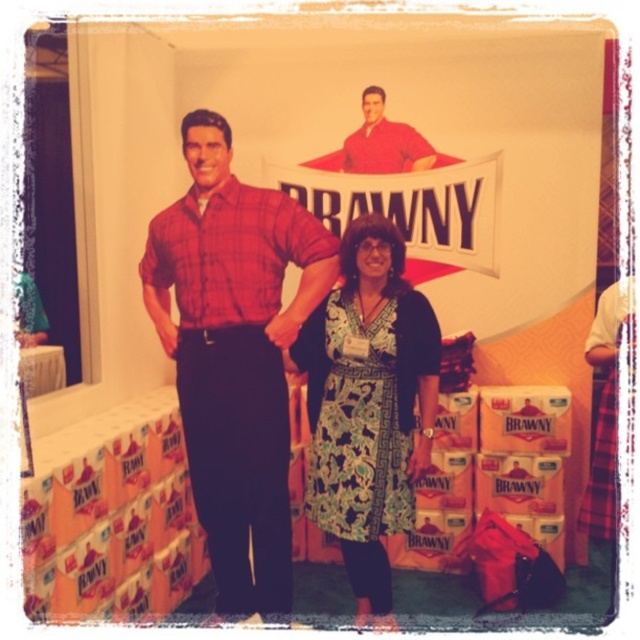
Question: Can you confirm if printed fabric dress at center is smaller than matte red shirt at center?

Choices:
 (A) yes
 (B) no

Answer: (B)

Question: Which object is farther from the camera taking this photo?

Choices:
 (A) printed fabric dress at center
 (B) matte red shirt at center

Answer: (B)

Question: Can you confirm if printed fabric dress at center is bigger than matte red shirt at center?

Choices:
 (A) no
 (B) yes

Answer: (B)

Question: Which of the following is the closest to the observer?

Choices:
 (A) [x=348, y=550]
 (B) [x=364, y=140]

Answer: (A)

Question: Where is printed fabric dress at center located in relation to matte red shirt at center in the image?

Choices:
 (A) right
 (B) left

Answer: (B)

Question: Which point appears closest to the camera in this image?

Choices:
 (A) (392, 509)
 (B) (371, 166)
 (C) (195, 186)

Answer: (C)